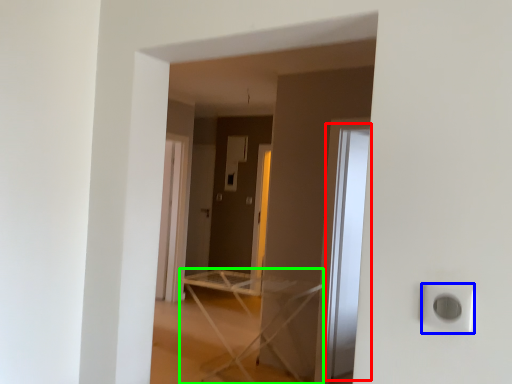
Question: Which object is positioned closest to glass door (highlighted by a red box)? Select from electric outlet (highlighted by a blue box) and furniture (highlighted by a green box).

Choices:
 (A) electric outlet
 (B) furniture

Answer: (B)